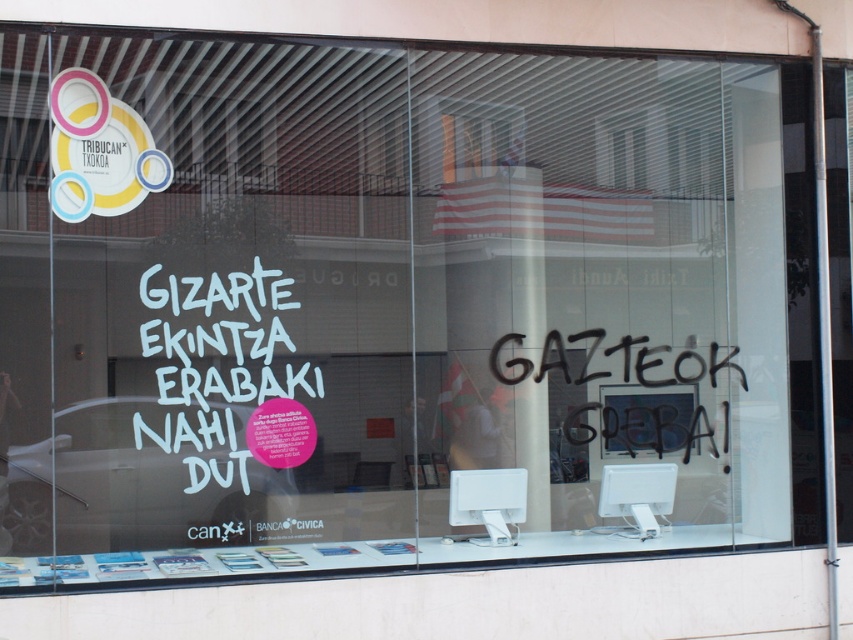
Does white vinyl text at center have a greater height compared to black spray paint at center?

Correct, white vinyl text at center is much taller as black spray paint at center.

Who is positioned more to the left, white vinyl text at center or black spray paint at center?

white vinyl text at center

In order to click on white vinyl text at center in this screenshot , I will do `click(216, 369)`.